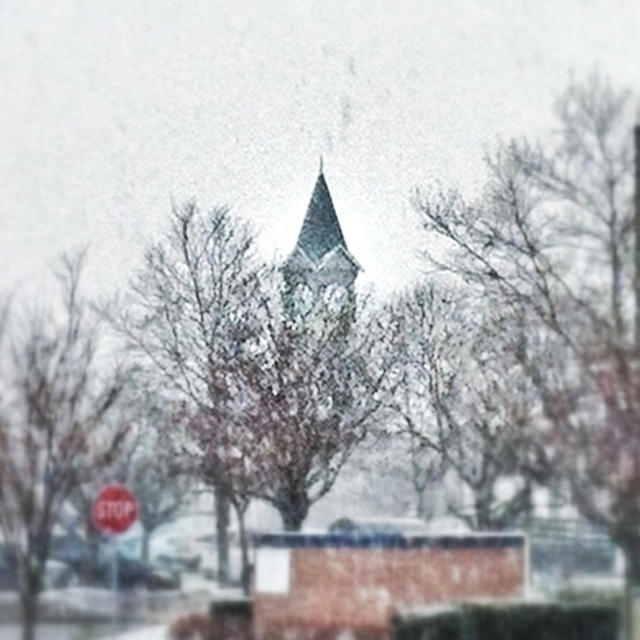
Question: Is snow-covered tree at center thinner than smooth brown tree at lower left?

Choices:
 (A) yes
 (B) no

Answer: (A)

Question: Can you confirm if snow-covered tree at center is bigger than red matte stop sign at lower left?

Choices:
 (A) yes
 (B) no

Answer: (B)

Question: Which point is closer to the camera taking this photo?

Choices:
 (A) (486, 243)
 (B) (84, 444)

Answer: (B)

Question: Which object is positioned closest to the smooth brown tree at lower left?

Choices:
 (A) snow-covered tree at center
 (B) red matte stop sign at lower left
 (C) snow-covered branches at center

Answer: (B)

Question: Is snow-covered tree at center bigger than smooth brown tree at lower left?

Choices:
 (A) yes
 (B) no

Answer: (B)

Question: Which of the following is the farthest from the observer?

Choices:
 (A) pyautogui.click(x=298, y=332)
 (B) pyautogui.click(x=113, y=522)

Answer: (B)